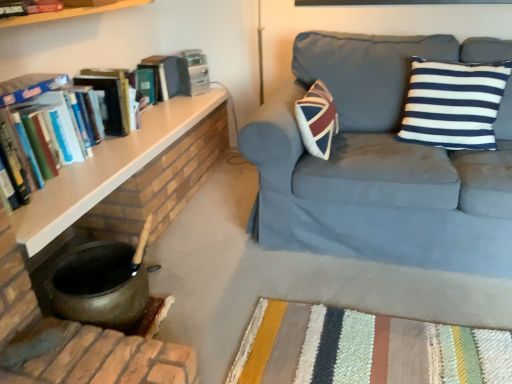
Identify the location of vacant space in front of suede blue couch at upper right. This screenshot has height=384, width=512. click(378, 324).